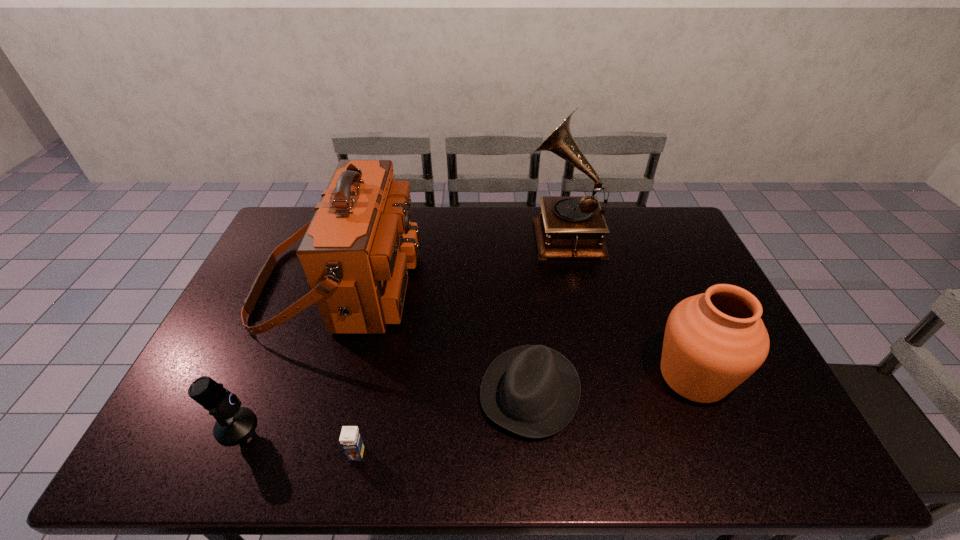
Where is `free space that satisfies the following two spatial constraints: 1. on the face side of the satchel; 2. on the back side of the fedora`? This screenshot has width=960, height=540. free space that satisfies the following two spatial constraints: 1. on the face side of the satchel; 2. on the back side of the fedora is located at coordinates (303, 392).

Where is `free space that satisfies the following two spatial constraints: 1. on the horn of the record player; 2. on the front label of the nearest object`? The image size is (960, 540). free space that satisfies the following two spatial constraints: 1. on the horn of the record player; 2. on the front label of the nearest object is located at coordinates (611, 454).

Where is `vacant space that satisfies the following two spatial constraints: 1. on the horn of the record player; 2. on the right side of the third tallest object`? vacant space that satisfies the following two spatial constraints: 1. on the horn of the record player; 2. on the right side of the third tallest object is located at coordinates (593, 376).

Where is `free space that satisfies the following two spatial constraints: 1. on the face side of the rightmost object; 2. on the right side of the satchel`? free space that satisfies the following two spatial constraints: 1. on the face side of the rightmost object; 2. on the right side of the satchel is located at coordinates (309, 376).